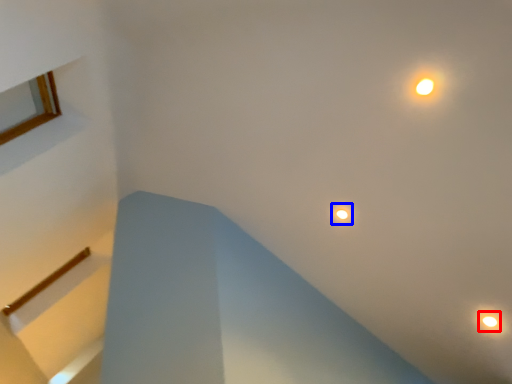
Question: Which object appears farthest to the camera in this image, droplight (highlighted by a red box) or droplight (highlighted by a blue box)?

Choices:
 (A) droplight
 (B) droplight

Answer: (B)